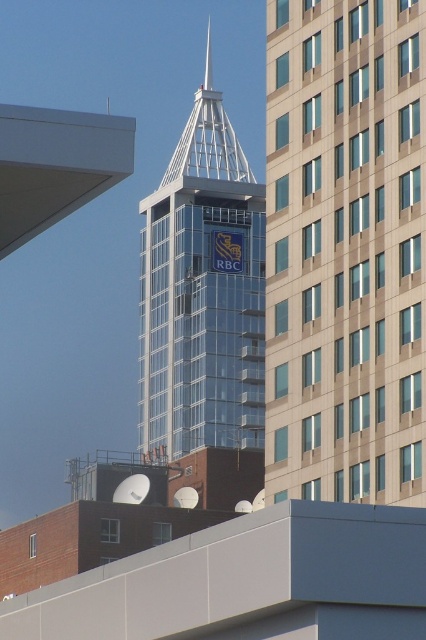
Question: Which point is farther from the camera taking this photo?

Choices:
 (A) (259, 442)
 (B) (345, 84)

Answer: (A)

Question: Is beige glass building at center above clear glass tower at center?

Choices:
 (A) yes
 (B) no

Answer: (B)

Question: Among these objects, which one is nearest to the camera?

Choices:
 (A) beige glass building at center
 (B) clear glass tower at center

Answer: (A)

Question: Which point is farther to the camera?

Choices:
 (A) (160, 244)
 (B) (333, 100)

Answer: (A)

Question: Can you confirm if beige glass building at center is wider than clear glass tower at center?

Choices:
 (A) yes
 (B) no

Answer: (B)

Question: Does beige glass building at center have a smaller size compared to clear glass tower at center?

Choices:
 (A) no
 (B) yes

Answer: (B)